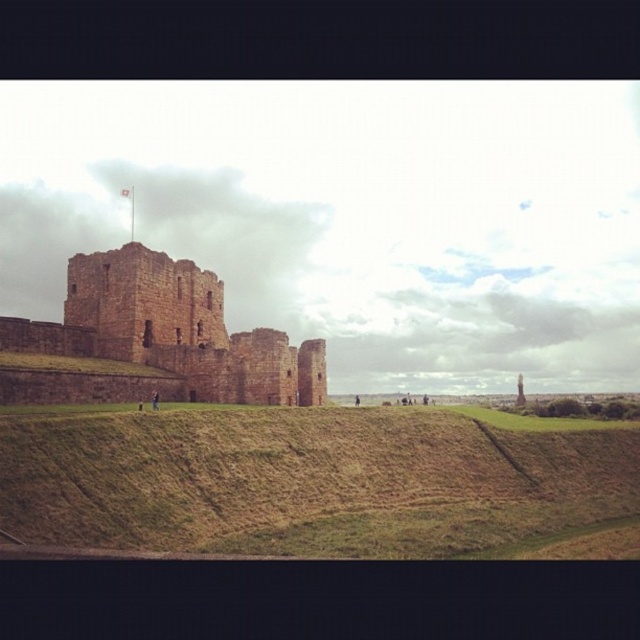
Can you confirm if brown grassy hill at lower center is positioned to the left of brown stone castle at center?

In fact, brown grassy hill at lower center is to the right of brown stone castle at center.

The image size is (640, 640). I want to click on brown grassy hill at lower center, so click(307, 481).

Find the location of `brown grassy hill at lower center`. brown grassy hill at lower center is located at coordinates (307, 481).